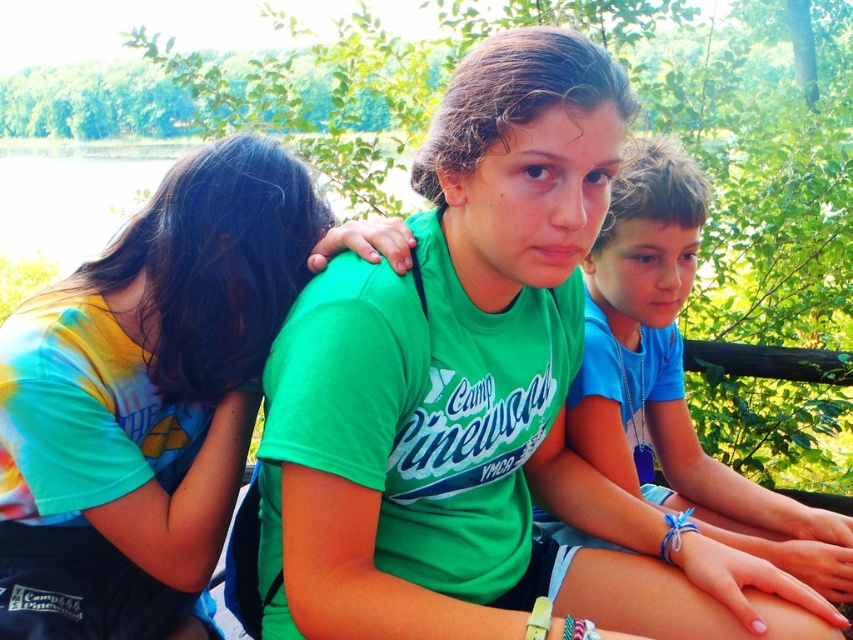
Does green cotton shirt at center lie behind blue rubber band at center?

Yes, green cotton shirt at center is behind blue rubber band at center.

Can you confirm if green cotton shirt at center is shorter than blue rubber band at center?

In fact, green cotton shirt at center may be taller than blue rubber band at center.

At what (x,y) coordinates should I click in order to perform the action: click on green cotton shirt at center. Please return your answer as a coordinate pair (x, y). The width and height of the screenshot is (853, 640). Looking at the image, I should click on pos(674,378).

This screenshot has width=853, height=640. What do you see at coordinates (480, 401) in the screenshot?
I see `green matte t-shirt at center` at bounding box center [480, 401].

Is green matte t-shirt at center shorter than white rubber bracelet at lower center?

In fact, green matte t-shirt at center may be taller than white rubber bracelet at lower center.

The height and width of the screenshot is (640, 853). What are the coordinates of `green matte t-shirt at center` in the screenshot? It's located at (480, 401).

At what (x,y) coordinates should I click in order to perform the action: click on green matte t-shirt at center. Please return your answer as a coordinate pair (x, y). The width and height of the screenshot is (853, 640). Looking at the image, I should click on (480, 401).

Is green matte t-shirt at center smaller than white string bracelet at lower right?

No, green matte t-shirt at center is not smaller than white string bracelet at lower right.

Is green matte t-shirt at center positioned behind white string bracelet at lower right?

No, it is in front of white string bracelet at lower right.

Identify the location of green matte t-shirt at center. coord(480,401).

Where is `green matte t-shirt at center`? The width and height of the screenshot is (853, 640). green matte t-shirt at center is located at coordinates (480, 401).